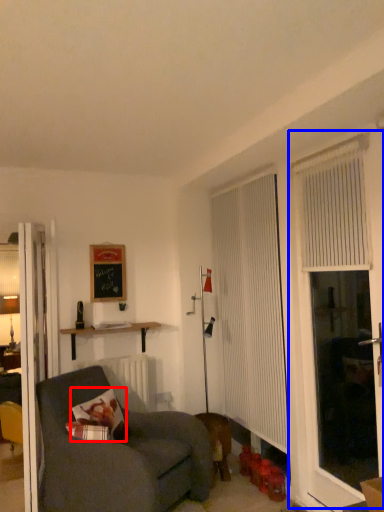
Question: Which point is further to the camera, pillow (highlighted by a red box) or screen door (highlighted by a blue box)?

Choices:
 (A) pillow
 (B) screen door

Answer: (A)